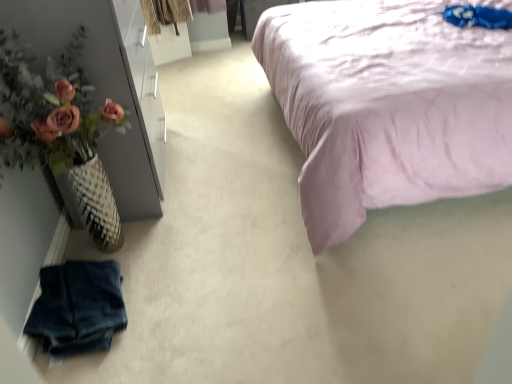
Question: From a real-world perspective, is faded denim shorts at lower left physically located above or below lavender satin bed at upper right?

Choices:
 (A) above
 (B) below

Answer: (B)

Question: In terms of width, does faded denim shorts at lower left look wider or thinner when compared to lavender satin bed at upper right?

Choices:
 (A) wide
 (B) thin

Answer: (B)

Question: Considering the real-world distances, which object is closest to the lavender satin bed at upper right?

Choices:
 (A) faded denim shorts at lower left
 (B) matte pink flowers at left

Answer: (B)

Question: Estimate the real-world distances between objects in this image. Which object is farther from the faded denim shorts at lower left?

Choices:
 (A) matte pink flowers at left
 (B) lavender satin bed at upper right

Answer: (B)